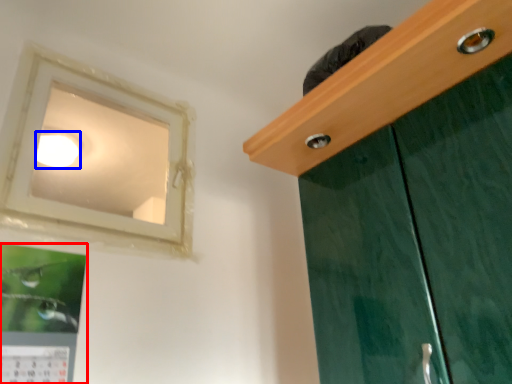
Question: Which point is further to the camera, picture frame (highlighted by a red box) or lighting (highlighted by a blue box)?

Choices:
 (A) picture frame
 (B) lighting

Answer: (B)